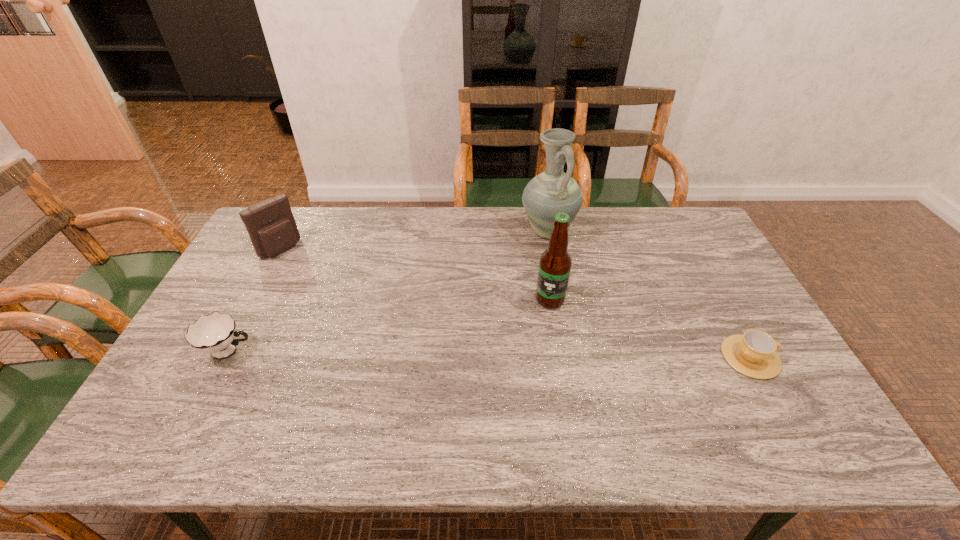
Identify the location of object that is the third closest to the third tallest object. The width and height of the screenshot is (960, 540). (555, 263).

You are a GUI agent. You are given a task and a screenshot of the screen. Output one action in this format:
    pyautogui.click(x=<x>, y=<y>)
    Task: Click on the vacant space that satisfies the following two spatial constraints: 1. on the front side of the pouch; 2. on the side of the left cup with the handle
    The width and height of the screenshot is (960, 540).
    Given the screenshot: What is the action you would take?
    pyautogui.click(x=227, y=352)

Locate an element on the screen. The width and height of the screenshot is (960, 540). free spot that satisfies the following two spatial constraints: 1. on the front side of the third shortest object; 2. with the handle on the side of the rightmost object is located at coordinates pos(224,357).